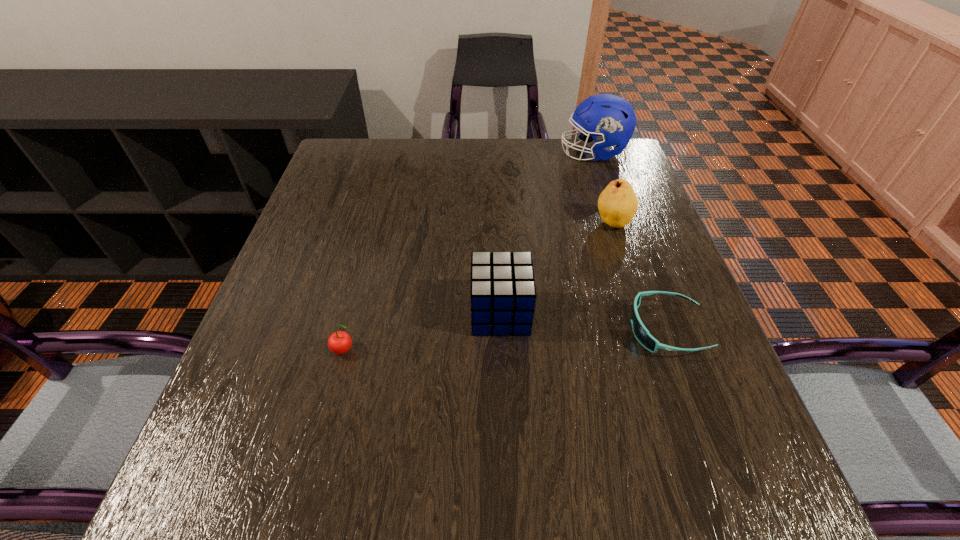
The width and height of the screenshot is (960, 540). In order to click on free space between the tallest object and the pear in this screenshot , I will do `click(603, 188)`.

Locate an element on the screen. This screenshot has height=540, width=960. empty location between the cherry and the second object from left to right is located at coordinates (422, 332).

The width and height of the screenshot is (960, 540). In order to click on free point between the cube and the second farthest object in this screenshot , I will do `click(557, 268)`.

Where is `vacant area that lies between the cherry and the football helmet`? The image size is (960, 540). vacant area that lies between the cherry and the football helmet is located at coordinates (469, 252).

I want to click on free area in between the shortest object and the fourth object from right to left, so click(x=584, y=321).

I want to click on object that ranks as the fourth closest to the leftmost object, so click(x=611, y=120).

Where is `object that ranks as the closest to the tallest object`? Image resolution: width=960 pixels, height=540 pixels. object that ranks as the closest to the tallest object is located at coordinates (617, 204).

What are the coordinates of `free space that satisfies the following two spatial constraints: 1. on the back side of the second object from left to right; 2. on the right side of the pear` in the screenshot? It's located at (496, 222).

Find the location of a particular element. free space in the image that satisfies the following two spatial constraints: 1. on the front-facing side of the football helmet; 2. on the front side of the cube is located at coordinates (648, 313).

This screenshot has width=960, height=540. I want to click on blank space that satisfies the following two spatial constraints: 1. on the back side of the cube; 2. on the right side of the fourth nearest object, so click(496, 222).